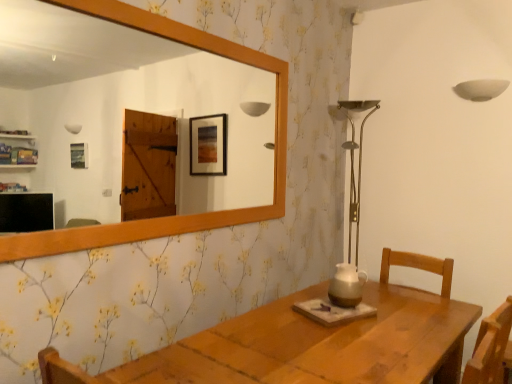
The image size is (512, 384). What are the coordinates of `vacant space in front of brown ceramic pitcher at center` in the screenshot? It's located at [342, 309].